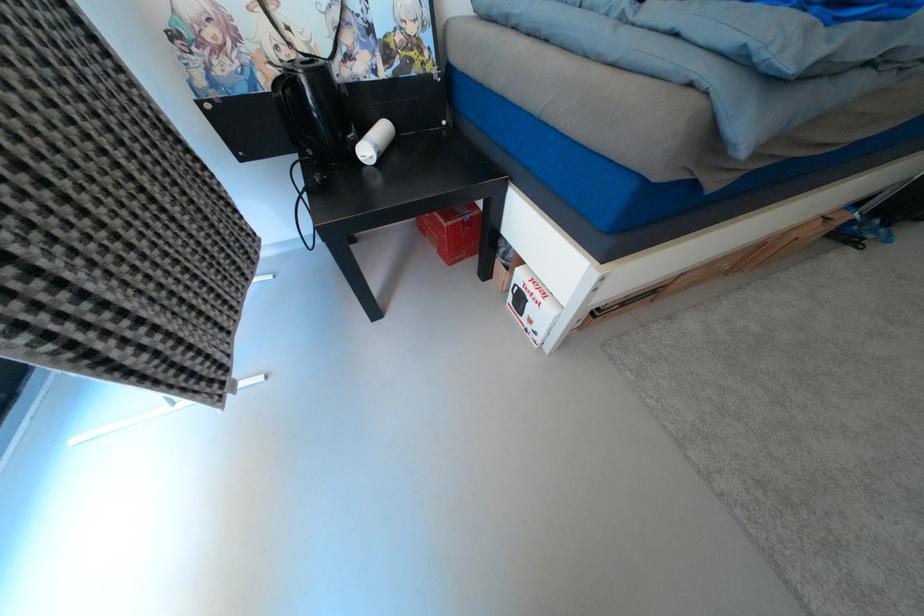
Find where to lift the red cardboard box. Please return your answer as a coordinate pair (x, y).

(453, 232)